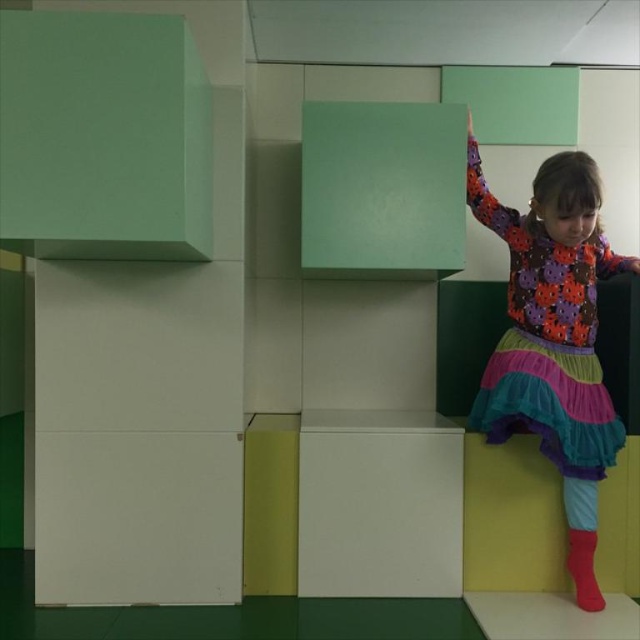
Between point (492, 228) and point (582, 550), which one is positioned in front?

Point (582, 550) is more forward.

Which is behind, point (600, 444) or point (592, 596)?

The point (592, 596) is behind.

Where is `multicolored fabric dress at right`? multicolored fabric dress at right is located at coordinates (552, 324).